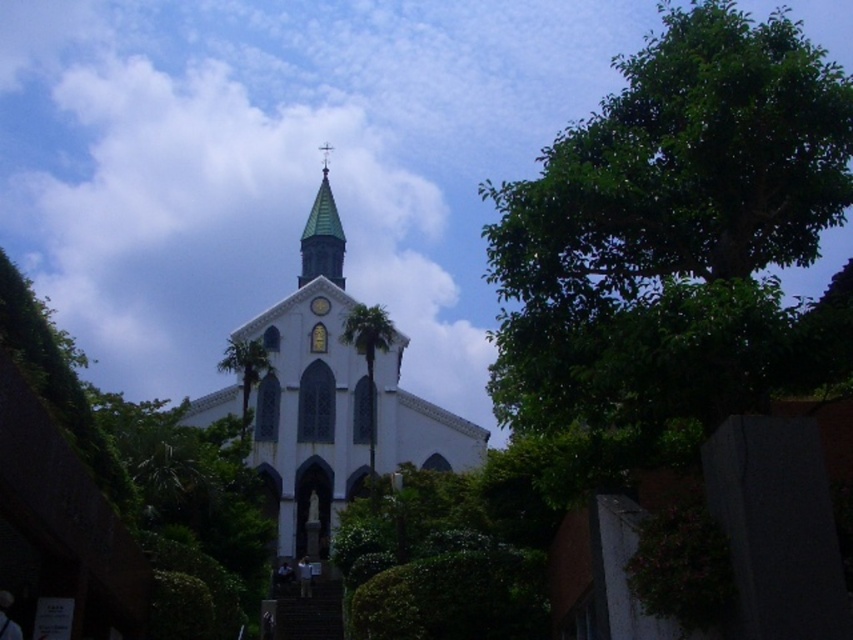
Find the location of `green glazed steeple at center`. green glazed steeple at center is located at coordinates (322, 234).

Is point (320, 189) positioned behind point (315, 307)?

That is True.

The width and height of the screenshot is (853, 640). In order to click on green glazed steeple at center in this screenshot , I will do `click(322, 234)`.

Is green leafy tree at upper right wider than green leafy palm at center?

Yes, green leafy tree at upper right is wider than green leafy palm at center.

Can you confirm if green leafy tree at upper right is thinner than green leafy palm at center?

No, green leafy tree at upper right is not thinner than green leafy palm at center.

Is point (569, 156) positioned behind point (387, 349)?

No, it is not.

Where is `green leafy tree at upper right`? This screenshot has width=853, height=640. green leafy tree at upper right is located at coordinates (676, 173).

Can you confirm if green leafy palm at center is positioned to the left of white glossy clock at upper center?

No, green leafy palm at center is not to the left of white glossy clock at upper center.

Which is in front, point (366, 358) or point (311, 300)?

Point (366, 358) is in front.

Is point (358, 326) less distant than point (322, 298)?

Yes, point (358, 326) is in front of point (322, 298).

Identify the location of green leafy palm at center. The width and height of the screenshot is (853, 640). (369, 358).